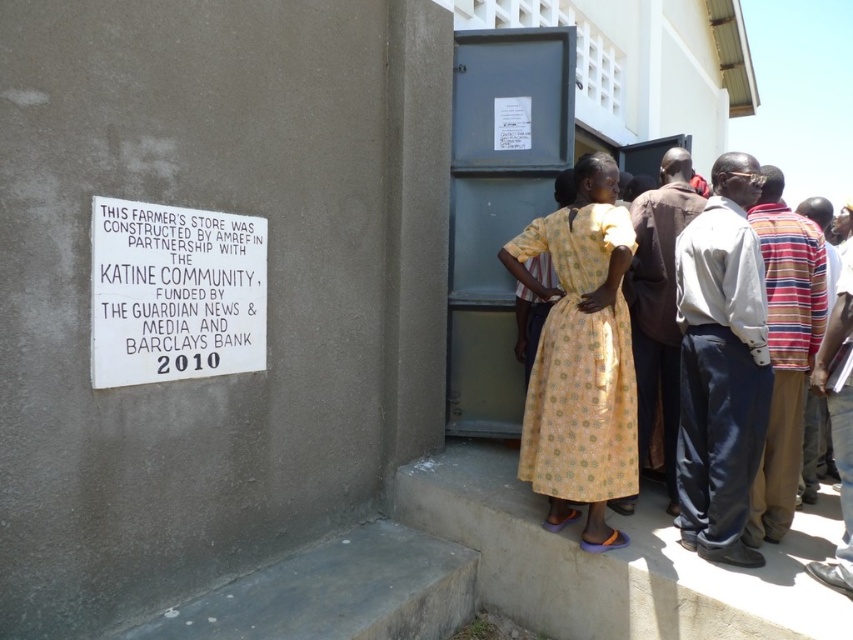
Who is higher up, white paper sign at upper left or yellow printed dress at center?

white paper sign at upper left is above.

Which is more to the right, white paper sign at upper left or yellow printed dress at center?

→ yellow printed dress at center is more to the right.

Where is `white paper sign at upper left`? white paper sign at upper left is located at coordinates (173, 292).

Find the location of a particular element. The image size is (853, 640). white paper sign at upper left is located at coordinates (173, 292).